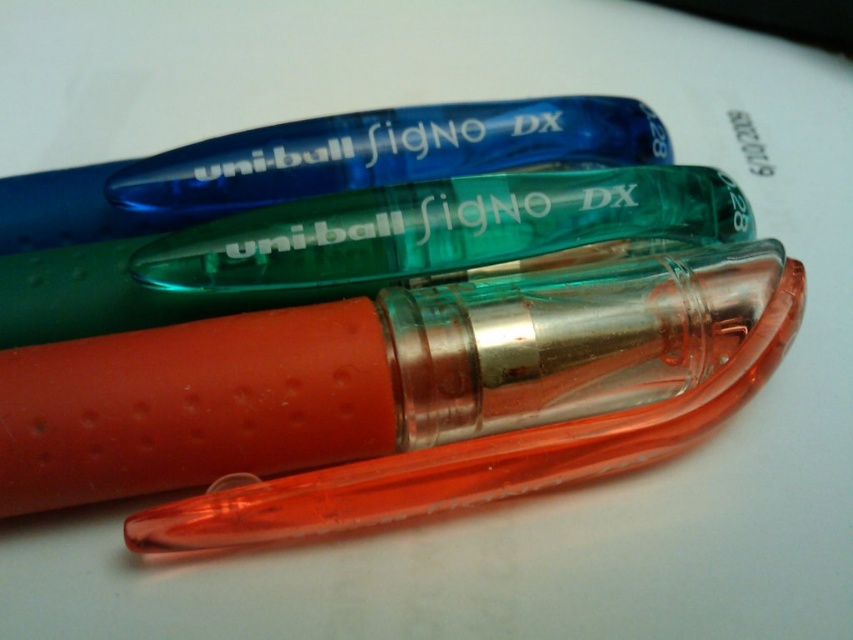
You are organizing a stationery store shelf and need to arrange the translucent orange pen at center and the translucent green pen at center. If you want to place the larger pen on the top shelf and the smaller one on the bottom shelf, which pen should go where?

The translucent orange pen at center is larger in size than the translucent green pen at center, so the translucent orange pen at center should be placed on the top shelf and the translucent green pen at center on the bottom shelf.

You are an office worker who needs to choose between the translucent orange pen at center and the translucent green pen at center for a task requiring a thicker pen. Which pen should you choose?

The translucent orange pen at center has a greater width than the translucent green pen at center, so you should choose the translucent orange pen at center for the task requiring a thicker pen.

You are trying to determine the orientation of the pens. If you were to draw a line connecting point (671, 440) and point (158, 248), which point would be closer to you?

Point (671, 440) is closer to the viewer than point (158, 248).